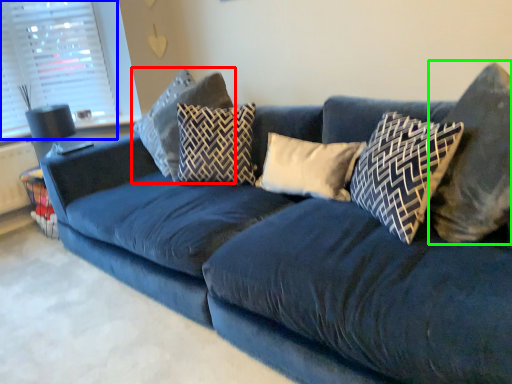
Question: Considering the real-world distances, which object is farthest from pillow (highlighted by a red box)? window screen (highlighted by a blue box) or pillow (highlighted by a green box)?

Choices:
 (A) window screen
 (B) pillow

Answer: (B)